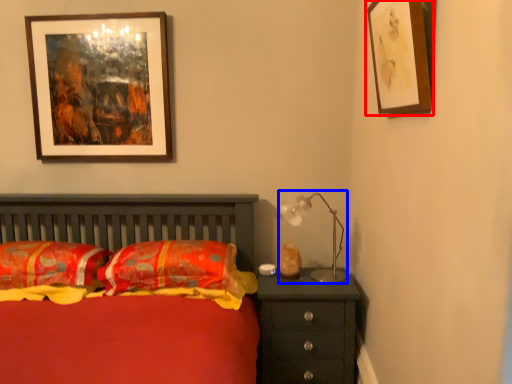
Question: Which object is further to the camera taking this photo, picture frame (highlighted by a red box) or table lamp (highlighted by a blue box)?

Choices:
 (A) picture frame
 (B) table lamp

Answer: (B)